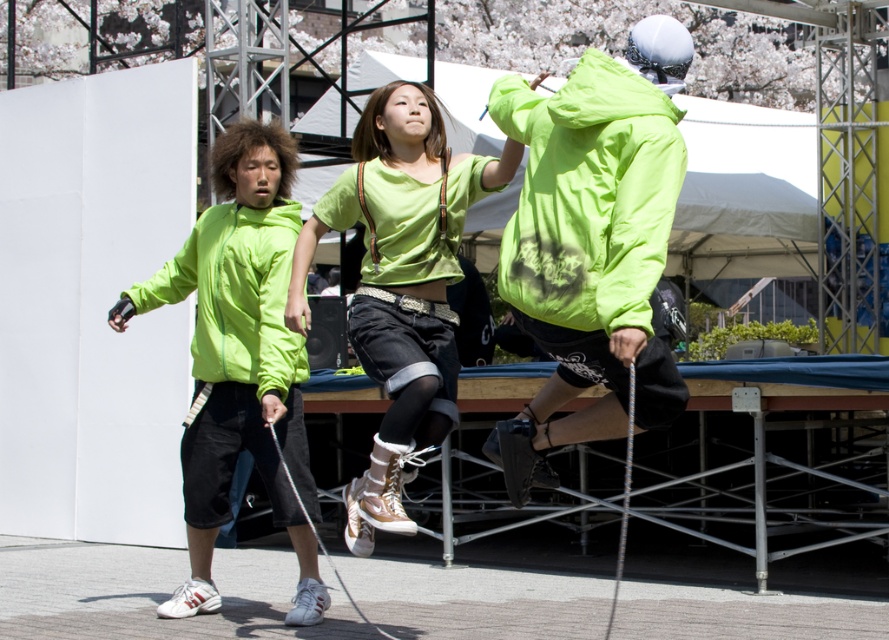
You are a photographer positioned at the origin point of the image coordinate system. You want to capture a closeup shot of the neon green jacket at center. What are the coordinates where you should aim your camera?

The coordinates to aim your camera are at point (591,244) where the neon green jacket at center is located.